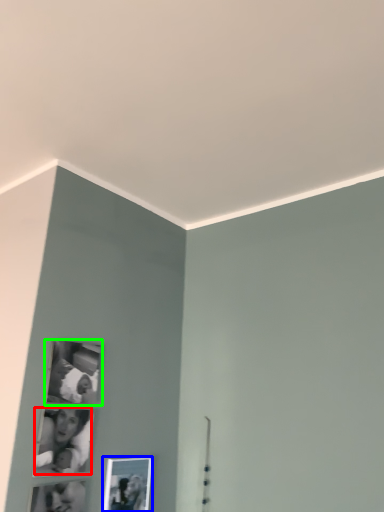
Question: Which object is the closest to the couple (highlighted by a red box)? Choose among these: picture frame (highlighted by a blue box) or picture frame (highlighted by a green box).

Choices:
 (A) picture frame
 (B) picture frame

Answer: (B)